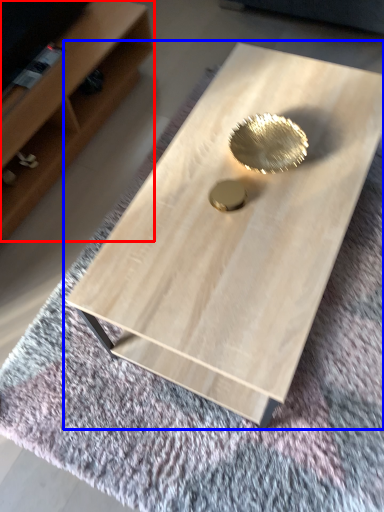
Question: Among these objects, which one is nearest to the camera, shelf (highlighted by a red box) or coffee table (highlighted by a blue box)?

Choices:
 (A) shelf
 (B) coffee table

Answer: (B)